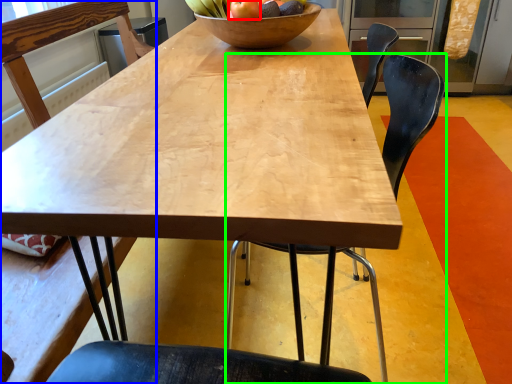
Question: Which is farther away from apple (highlighted by a red box)? chair (highlighted by a blue box) or chair (highlighted by a green box)?

Choices:
 (A) chair
 (B) chair

Answer: (A)